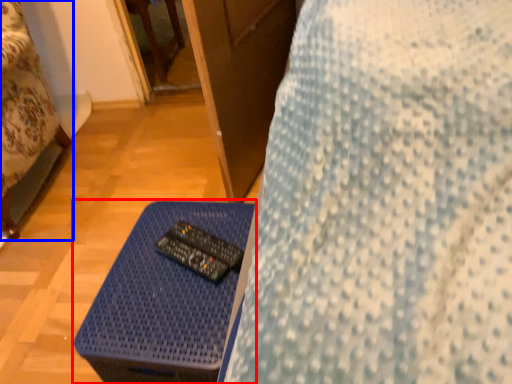
Question: Which of the following is the farthest to the observer, table (highlighted by a red box) or furniture (highlighted by a blue box)?

Choices:
 (A) table
 (B) furniture

Answer: (B)